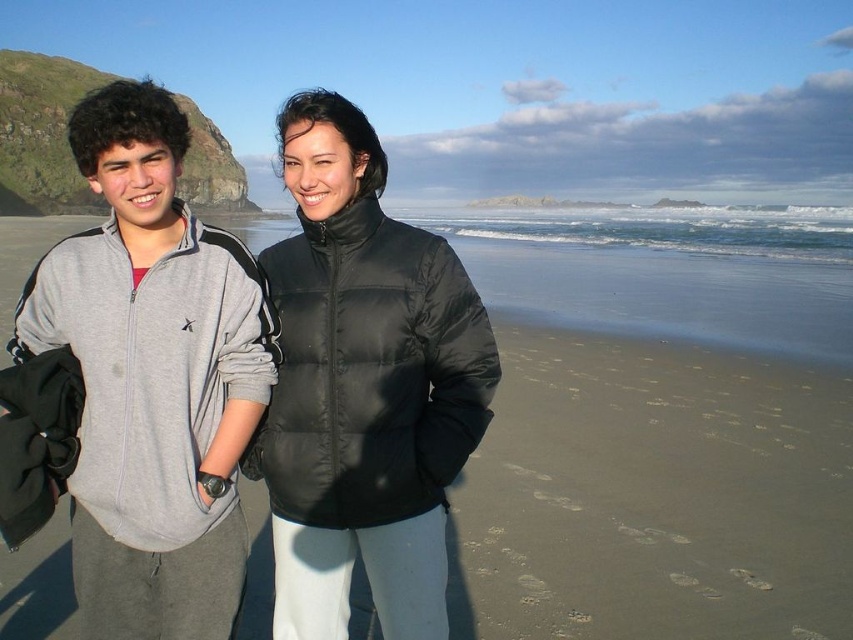
Question: Does sandy beach at center appear under black puffer jacket at center?

Choices:
 (A) yes
 (B) no

Answer: (B)

Question: Which object is farther from the camera taking this photo?

Choices:
 (A) black puffer jacket at center
 (B) gray fleece jacket at left
 (C) sandy beach at center

Answer: (A)

Question: Which of the following is the closest to the observer?

Choices:
 (A) black puffer jacket at center
 (B) gray fleece jacket at left

Answer: (B)

Question: Does gray fleece jacket at left appear on the left side of black puffer jacket at center?

Choices:
 (A) no
 (B) yes

Answer: (B)

Question: Is sandy beach at center to the left of black puffer jacket at center from the viewer's perspective?

Choices:
 (A) yes
 (B) no

Answer: (A)

Question: Considering the real-world distances, which object is closest to the sandy beach at center?

Choices:
 (A) black puffer jacket at center
 (B) gray fleece jacket at left

Answer: (A)